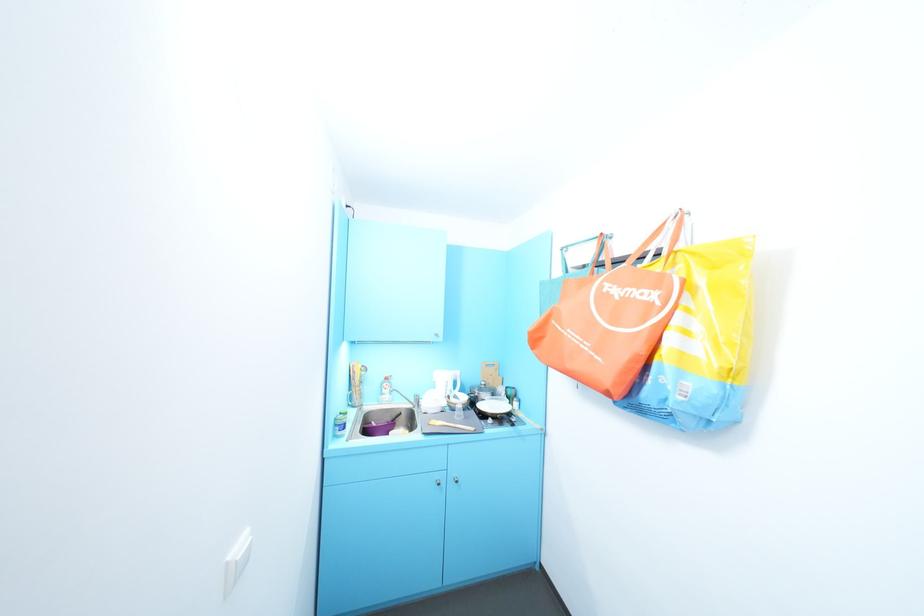
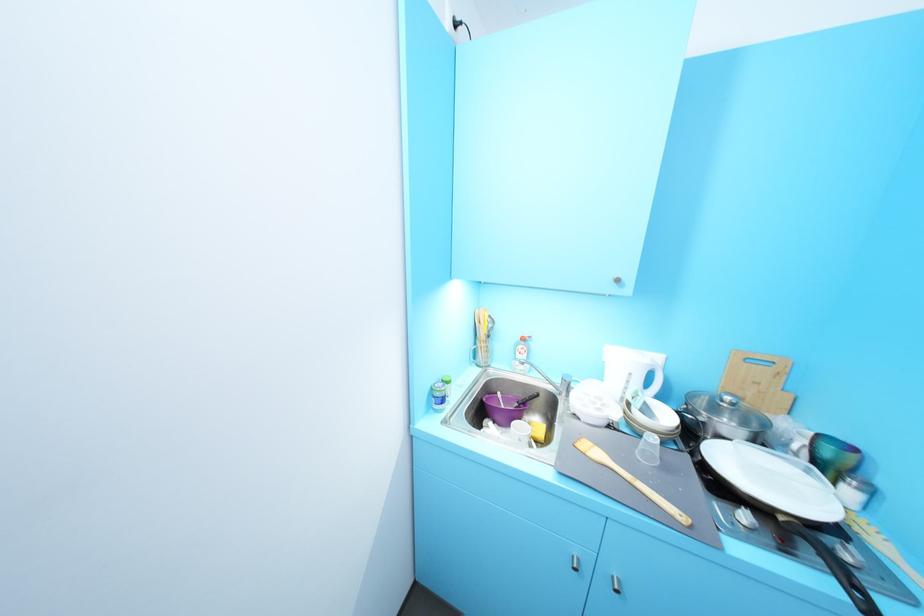
Locate, in the second image, the point that corresponds to point (472, 418) in the first image.

(673, 468)